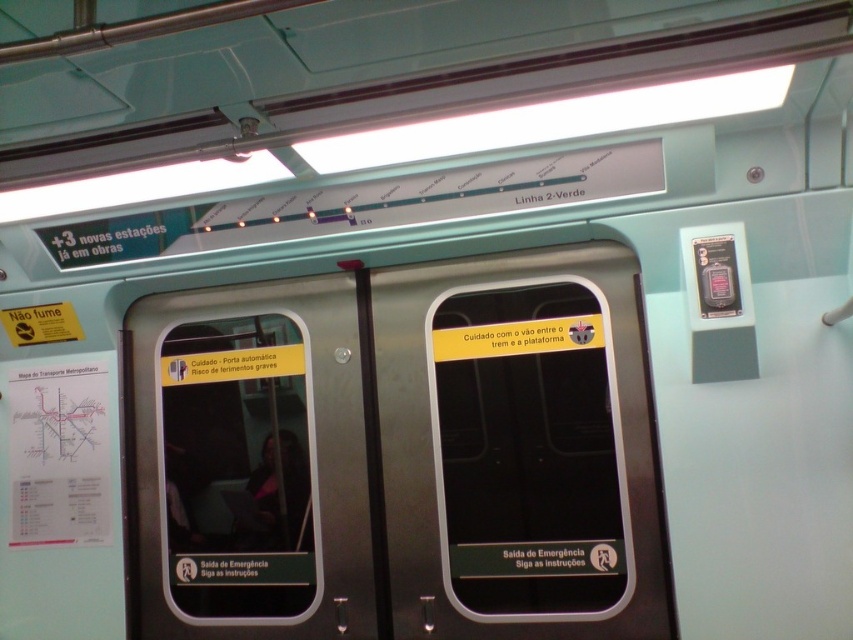
You are a passenger on the subway train and need to locate the emergency exit. Both the metallic silver emergency exit door at center and the metallic silver door at center are in front of you. Which one is bigger?

The metallic silver emergency exit door at center is larger in size compared to the metallic silver door at center, so the emergency exit door is bigger.

You are a passenger standing inside the subway car near the doors. You need to locate the emergency exit door. Which door should you go towards, the metallic silver emergency exit door at center or the metallic silver door at center?

The metallic silver emergency exit door at center is in front of the metallic silver door at center, so you should go towards the metallic silver emergency exit door at center as it is closer to you.